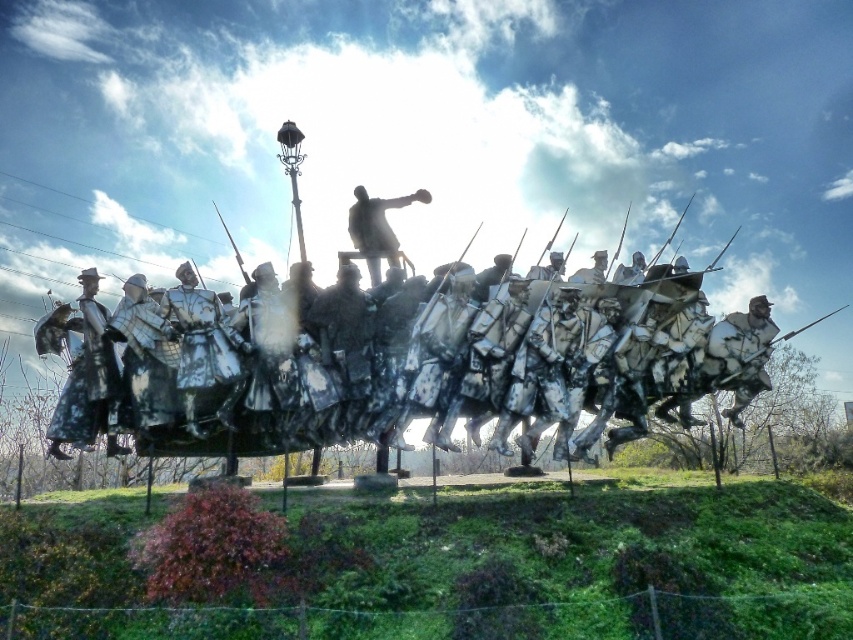
Question: Which of the following is the closest to the observer?

Choices:
 (A) bronze statue at center
 (B) shiny silver armor at left
 (C) silver metallic spear at right
 (D) metallic silver soldiers at center

Answer: (D)

Question: Is metallic silver soldiers at center to the right of silver metallic spear at right from the viewer's perspective?

Choices:
 (A) yes
 (B) no

Answer: (B)

Question: Considering the relative positions of shiny silver armor at left and bronze statue at center in the image provided, where is shiny silver armor at left located with respect to bronze statue at center?

Choices:
 (A) below
 (B) above

Answer: (A)

Question: Which object is farther from the camera taking this photo?

Choices:
 (A) shiny silver armor at left
 (B) metallic silver soldiers at center

Answer: (A)

Question: In this image, where is shiny silver armor at left located relative to bronze statue at center?

Choices:
 (A) left
 (B) right

Answer: (A)

Question: Which point is farther to the camera?

Choices:
 (A) (738, 369)
 (B) (368, 216)
 (C) (80, 376)

Answer: (B)